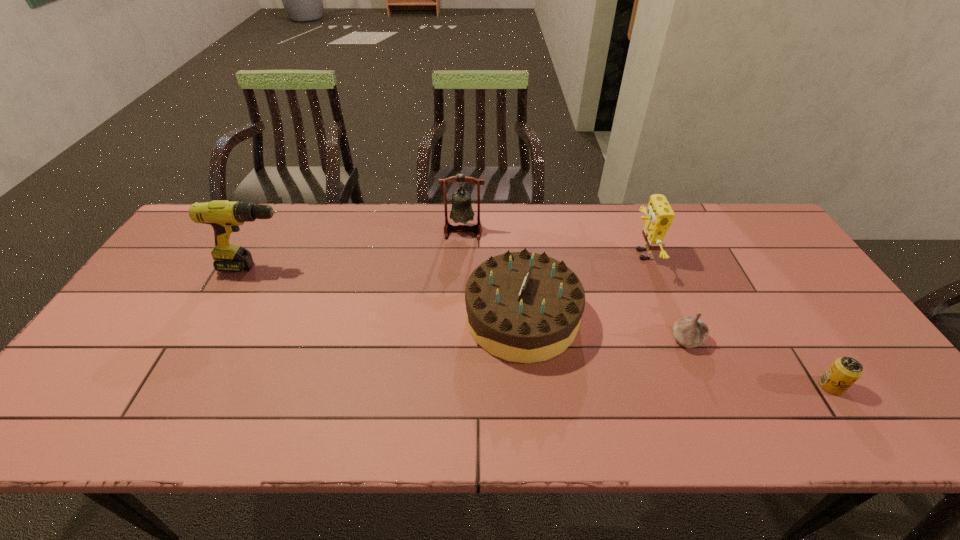
The width and height of the screenshot is (960, 540). What are the coordinates of `free space located on the face of the sponge` in the screenshot? It's located at (558, 254).

Find the location of a particular element. This screenshot has height=540, width=960. free space located 0.190m on the face of the sponge is located at coordinates (568, 254).

In order to click on vacant space located on the front-facing side of the third shortest object in this screenshot , I will do `click(379, 318)`.

You are a GUI agent. You are given a task and a screenshot of the screen. Output one action in this format:
    pyautogui.click(x=<x>, y=<y>)
    Task: Click on the vacant position located 0.300m on the front-facing side of the third shortest object
    Image resolution: width=960 pixels, height=540 pixels.
    Given the screenshot: What is the action you would take?
    pyautogui.click(x=352, y=318)

This screenshot has height=540, width=960. What are the coordinates of `vacant area located 0.050m on the front-facing side of the third shortest object` in the screenshot? It's located at (446, 318).

Find the location of `blank space located on the back of the garlic`. blank space located on the back of the garlic is located at coordinates (668, 295).

The width and height of the screenshot is (960, 540). In order to click on vacant area situated 0.370m on the left of the rightmost object in this screenshot , I will do `click(660, 386)`.

You are a GUI agent. You are given a task and a screenshot of the screen. Output one action in this format:
    pyautogui.click(x=<x>, y=<y>)
    Task: Click on the bell located at the far edge
    The height and width of the screenshot is (540, 960).
    Given the screenshot: What is the action you would take?
    pyautogui.click(x=461, y=211)

The height and width of the screenshot is (540, 960). I want to click on sponge positioned at the far edge, so click(x=659, y=216).

At what (x,y) coordinates should I click in order to perform the action: click on object at the right edge. Please return your answer as a coordinate pair (x, y). The image size is (960, 540). Looking at the image, I should click on (845, 371).